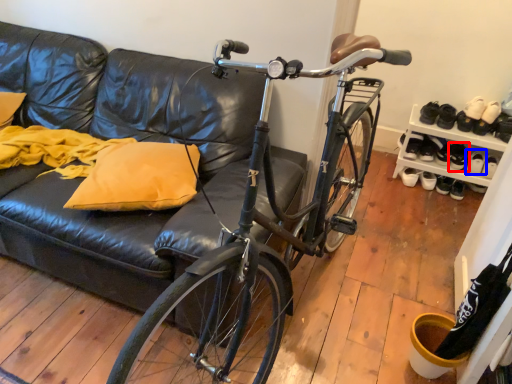
Question: Which object appears closest to the camera in this image, footwear (highlighted by a red box) or footwear (highlighted by a blue box)?

Choices:
 (A) footwear
 (B) footwear

Answer: (B)